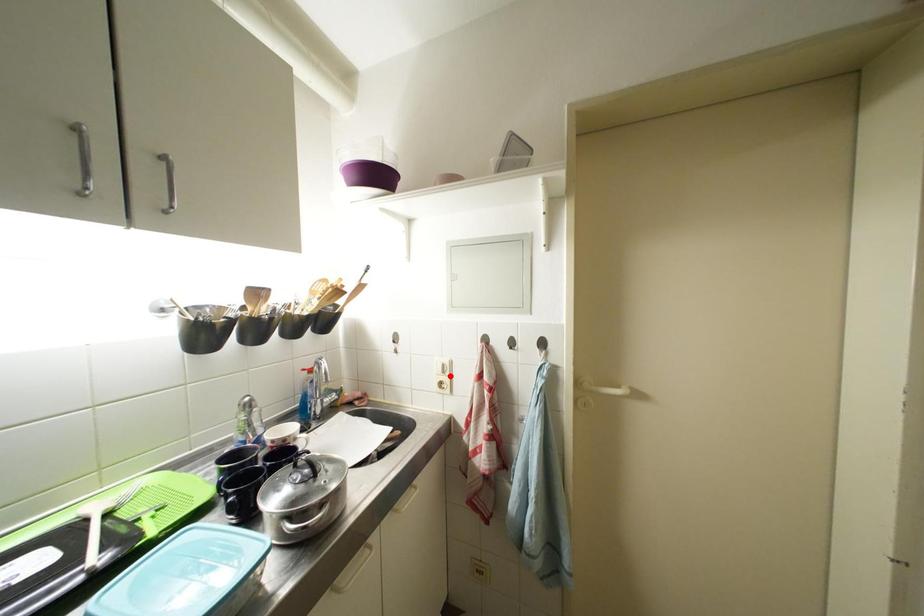
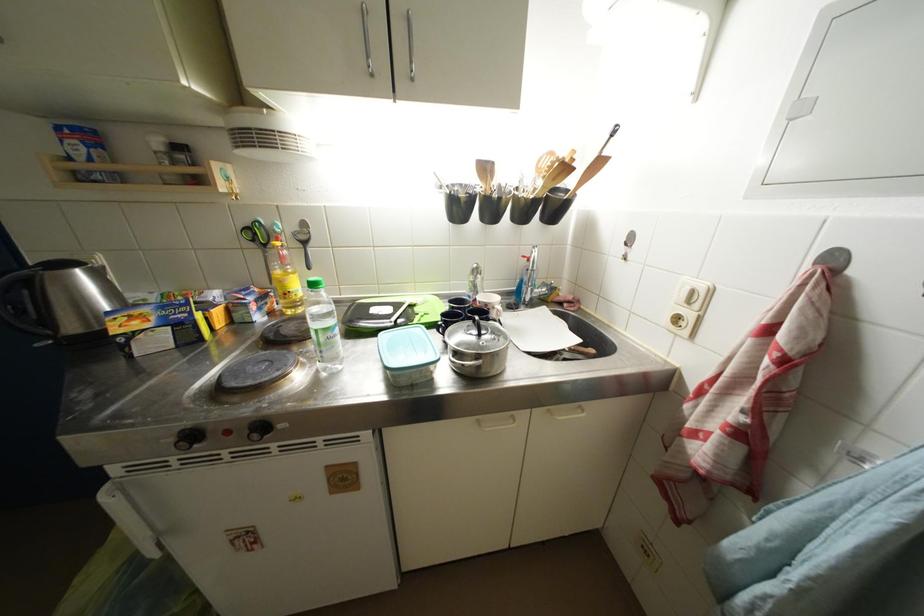
The point at the highlighted location is marked in the first image. Where is the corresponding point in the second image?

(696, 306)